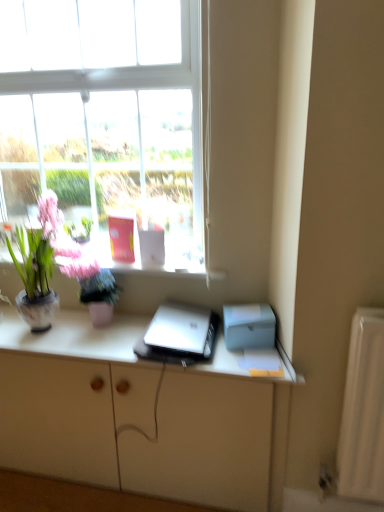
Question: Does silver metallic laptop at center come behind matte white cabinet at center?

Choices:
 (A) no
 (B) yes

Answer: (B)

Question: Could you tell me if silver metallic laptop at center is turned towards matte white cabinet at center?

Choices:
 (A) no
 (B) yes

Answer: (A)

Question: Can you confirm if silver metallic laptop at center is thinner than matte white cabinet at center?

Choices:
 (A) no
 (B) yes

Answer: (B)

Question: Is silver metallic laptop at center turned away from matte white cabinet at center?

Choices:
 (A) no
 (B) yes

Answer: (A)

Question: Is silver metallic laptop at center closer to the viewer compared to matte white cabinet at center?

Choices:
 (A) no
 (B) yes

Answer: (A)

Question: Considering the relative sizes of silver metallic laptop at center and matte white cabinet at center in the image provided, is silver metallic laptop at center wider than matte white cabinet at center?

Choices:
 (A) no
 (B) yes

Answer: (A)

Question: Is matte white cabinet at center wider than silver metallic laptop at center?

Choices:
 (A) no
 (B) yes

Answer: (B)

Question: Does matte white cabinet at center have a larger size compared to silver metallic laptop at center?

Choices:
 (A) no
 (B) yes

Answer: (B)

Question: Is matte white cabinet at center thinner than silver metallic laptop at center?

Choices:
 (A) yes
 (B) no

Answer: (B)

Question: Is matte white cabinet at center completely or partially outside of silver metallic laptop at center?

Choices:
 (A) no
 (B) yes

Answer: (B)

Question: Is matte white cabinet at center smaller than silver metallic laptop at center?

Choices:
 (A) no
 (B) yes

Answer: (A)

Question: Is matte white cabinet at center facing towards silver metallic laptop at center?

Choices:
 (A) yes
 (B) no

Answer: (B)

Question: Does matte ceramic vase at left have a greater height compared to matte white cabinet at center?

Choices:
 (A) no
 (B) yes

Answer: (A)